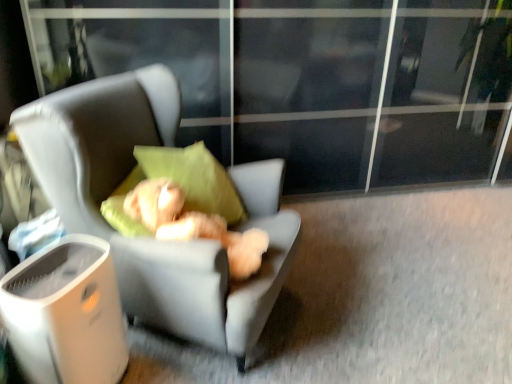
Measure the distance between point (11, 304) and camera.

The depth of point (11, 304) is 1.23 meters.

This screenshot has height=384, width=512. Describe the element at coordinates (312, 79) in the screenshot. I see `transparent glass screen door at upper center` at that location.

This screenshot has height=384, width=512. Find the location of `soft gray fabric chair at center`. soft gray fabric chair at center is located at coordinates (150, 239).

From a real-world perspective, does fluffy beige teddy bear at center sit lower than transparent glass screen door at upper center?

Yes, from a real-world perspective, fluffy beige teddy bear at center is under transparent glass screen door at upper center.

Based on their sizes in the image, would you say fluffy beige teddy bear at center is bigger or smaller than transparent glass screen door at upper center?

Clearly, fluffy beige teddy bear at center is smaller in size than transparent glass screen door at upper center.

Is fluffy beige teddy bear at center oriented away from transparent glass screen door at upper center?

No.

Is fluffy beige teddy bear at center closer to the viewer compared to transparent glass screen door at upper center?

Yes, the depth of fluffy beige teddy bear at center is less than that of transparent glass screen door at upper center.

Is soft gray fabric chair at center far from white plastic trash bin at lower left?

No, soft gray fabric chair at center is not far away from white plastic trash bin at lower left.

Which of these two, soft gray fabric chair at center or white plastic trash bin at lower left, is smaller?

white plastic trash bin at lower left is smaller.

I want to click on trash bin/can that is on the left side of soft gray fabric chair at center, so click(x=66, y=314).

Which of these two, transparent glass screen door at upper center or fluffy beige teddy bear at center, is wider?

Wider between the two is transparent glass screen door at upper center.

Can you confirm if transparent glass screen door at upper center is positioned to the left of fluffy beige teddy bear at center?

No, transparent glass screen door at upper center is not to the left of fluffy beige teddy bear at center.

From the image's perspective, is transparent glass screen door at upper center positioned above or below fluffy beige teddy bear at center?

From the image's perspective, transparent glass screen door at upper center appears above fluffy beige teddy bear at center.

Does transparent glass screen door at upper center contain fluffy beige teddy bear at center?

No.

From a real-world perspective, does soft gray fabric chair at center sit lower than fluffy beige teddy bear at center?

Yes.

Is soft gray fabric chair at center in front of fluffy beige teddy bear at center?

Yes, soft gray fabric chair at center is in front of fluffy beige teddy bear at center.

Considering the positions of objects soft gray fabric chair at center and fluffy beige teddy bear at center in the image provided, who is more to the right, soft gray fabric chair at center or fluffy beige teddy bear at center?

fluffy beige teddy bear at center is more to the right.

Considering the relative sizes of transparent glass screen door at upper center and soft gray fabric chair at center in the image provided, is transparent glass screen door at upper center thinner than soft gray fabric chair at center?

Yes.

Is the depth of transparent glass screen door at upper center greater than that of soft gray fabric chair at center?

Yes, transparent glass screen door at upper center is behind soft gray fabric chair at center.

Is transparent glass screen door at upper center completely or partially outside of soft gray fabric chair at center?

Yes, transparent glass screen door at upper center is not within soft gray fabric chair at center.

Who is taller, transparent glass screen door at upper center or soft gray fabric chair at center?

transparent glass screen door at upper center is taller.

From the image's perspective, is fluffy beige teddy bear at center below soft gray fabric chair at center?

Yes, from the image's perspective, fluffy beige teddy bear at center is beneath soft gray fabric chair at center.

Does fluffy beige teddy bear at center have a lesser height compared to soft gray fabric chair at center?

Correct, fluffy beige teddy bear at center is not as tall as soft gray fabric chair at center.

Is fluffy beige teddy bear at center directly adjacent to soft gray fabric chair at center?

No, fluffy beige teddy bear at center is not beside soft gray fabric chair at center.

How many degrees apart are the facing directions of fluffy beige teddy bear at center and soft gray fabric chair at center?

8.16 degrees separate the facing orientations of fluffy beige teddy bear at center and soft gray fabric chair at center.

Is white plastic trash bin at lower left oriented towards transparent glass screen door at upper center?

No.

How many degrees apart are the facing directions of white plastic trash bin at lower left and transparent glass screen door at upper center?

The angular difference between white plastic trash bin at lower left and transparent glass screen door at upper center is 54.8 degrees.

Considering the positions of point (116, 317) and point (258, 117), is point (116, 317) closer or farther from the camera than point (258, 117)?

Point (116, 317) appears to be closer to the viewer than point (258, 117).

From their relative heights in the image, would you say white plastic trash bin at lower left is taller or shorter than transparent glass screen door at upper center?

Considering their sizes, white plastic trash bin at lower left has less height than transparent glass screen door at upper center.

At what (x,y) coordinates should I click in order to perform the action: click on teddy bear located underneath the transparent glass screen door at upper center (from a real-world perspective). Please return your answer as a coordinate pair (x, y). The height and width of the screenshot is (384, 512). Looking at the image, I should click on (193, 224).

Locate an element on the screen. This screenshot has height=384, width=512. trash bin/can below the soft gray fabric chair at center (from the image's perspective) is located at coordinates (66, 314).

Which object lies nearer to the anchor point fluffy beige teddy bear at center, white plastic trash bin at lower left or soft gray fabric chair at center?

Based on the image, soft gray fabric chair at center appears to be nearer to fluffy beige teddy bear at center.

Based on their spatial positions, is white plastic trash bin at lower left or fluffy beige teddy bear at center further from soft gray fabric chair at center?

white plastic trash bin at lower left is positioned further to the anchor soft gray fabric chair at center.

When comparing their distances from fluffy beige teddy bear at center, does soft gray fabric chair at center or transparent glass screen door at upper center seem closer?

Among the two, soft gray fabric chair at center is located nearer to fluffy beige teddy bear at center.

Which object lies further to the anchor point transparent glass screen door at upper center, soft gray fabric chair at center or fluffy beige teddy bear at center?

The object further to transparent glass screen door at upper center is fluffy beige teddy bear at center.

Looking at the image, which one is located closer to transparent glass screen door at upper center, white plastic trash bin at lower left or soft gray fabric chair at center?

soft gray fabric chair at center.

Estimate the real-world distances between objects in this image. Which object is closer to soft gray fabric chair at center, fluffy beige teddy bear at center or transparent glass screen door at upper center?

The object closer to soft gray fabric chair at center is fluffy beige teddy bear at center.

In the scene shown: Looking at the image, which one is located closer to white plastic trash bin at lower left, transparent glass screen door at upper center or soft gray fabric chair at center?

soft gray fabric chair at center is closer to white plastic trash bin at lower left.

Based on the photo, which object lies nearer to the anchor point soft gray fabric chair at center, fluffy beige teddy bear at center or white plastic trash bin at lower left?

Among the two, fluffy beige teddy bear at center is located nearer to soft gray fabric chair at center.

Locate an element on the screen. teddy bear between soft gray fabric chair at center and white plastic trash bin at lower left in the up-down direction is located at coordinates (193, 224).

At what (x,y) coordinates should I click in order to perform the action: click on chair between white plastic trash bin at lower left and transparent glass screen door at upper center. Please return your answer as a coordinate pair (x, y). Looking at the image, I should click on (150, 239).

This screenshot has width=512, height=384. What are the coordinates of `teddy bear between white plastic trash bin at lower left and transparent glass screen door at upper center in the horizontal direction` in the screenshot? It's located at (193, 224).

I want to click on teddy bear located between soft gray fabric chair at center and transparent glass screen door at upper center in the depth direction, so click(193, 224).